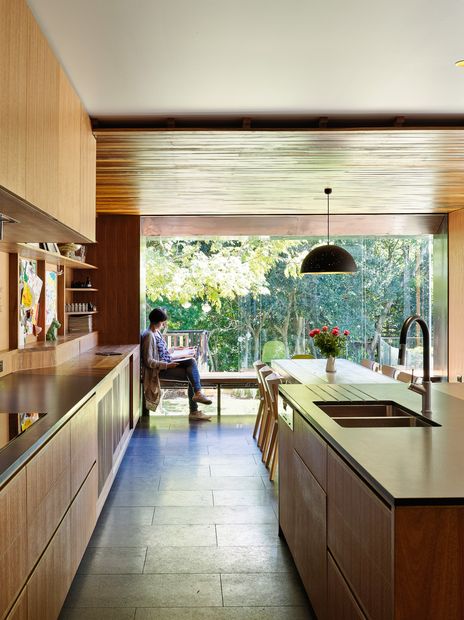
Locate an element on the screen. This screenshot has height=620, width=464. faucet is located at coordinates (408, 322).